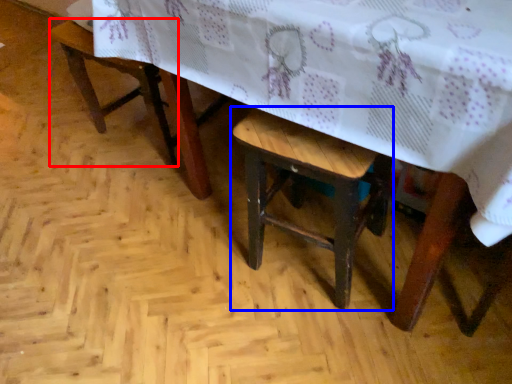
Question: Which of the following is the farthest to the observer, armchair (highlighted by a red box) or stool (highlighted by a blue box)?

Choices:
 (A) armchair
 (B) stool

Answer: (A)